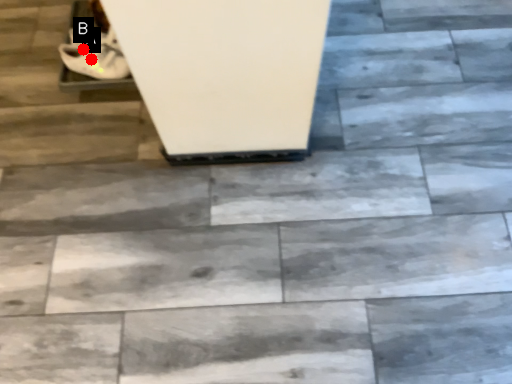
Question: Two points are circled on the image, labeled by A and B beside each circle. Which point is closer to the camera taking this photo?

Choices:
 (A) A is closer
 (B) B is closer

Answer: (A)